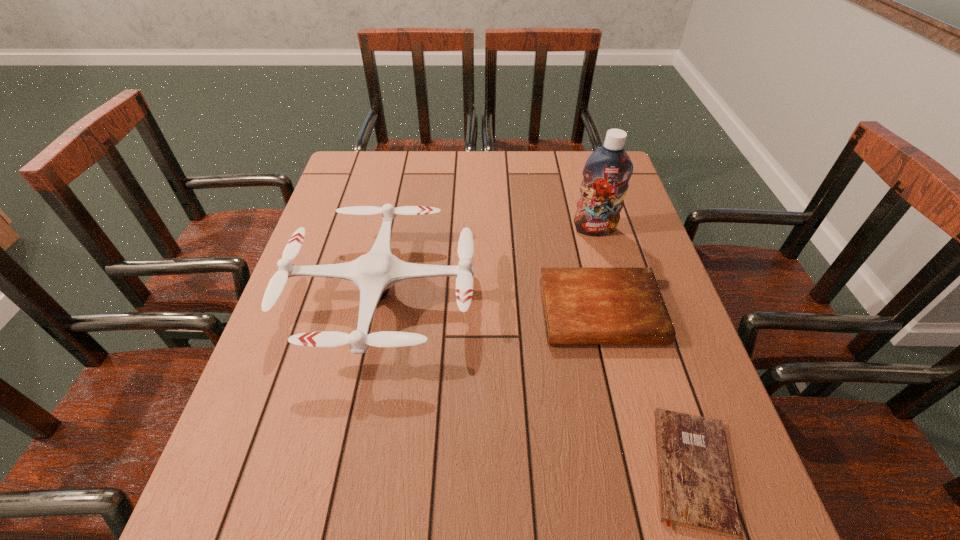
Identify the location of vacant space in between the taller Bible and the nearer Bible. The image size is (960, 540). (646, 390).

Identify the location of free space between the nearer Bible and the taller Bible. (646, 390).

Locate an element on the screen. This screenshot has height=540, width=960. unoccupied position between the second tallest object and the second shortest object is located at coordinates (492, 303).

I want to click on free area in between the shorter Bible and the third tallest object, so click(x=646, y=390).

In order to click on free area in between the shorter Bible and the taller Bible in this screenshot , I will do `click(646, 390)`.

I want to click on vacant space that is in between the drone and the shampoo, so click(x=489, y=262).

Where is `free spot between the nearer Bible and the leftmost object`? free spot between the nearer Bible and the leftmost object is located at coordinates (537, 382).

Point out which object is positioned as the nearest to the second shortest object. Please provide its 2D coordinates. Your answer should be formatted as a tuple, i.e. [(x, y)], where the tuple contains the x and y coordinates of a point satisfying the conditions above.

[(696, 490)]

Locate an element on the screen. The height and width of the screenshot is (540, 960). object that is the second closest one to the farther Bible is located at coordinates (374, 273).

Where is `vacant position in the image that satisfies the following two spatial constraints: 1. with the camera attached at the bottom of the shortest object; 2. on the right side of the third shortest object`? The height and width of the screenshot is (540, 960). vacant position in the image that satisfies the following two spatial constraints: 1. with the camera attached at the bottom of the shortest object; 2. on the right side of the third shortest object is located at coordinates (347, 469).